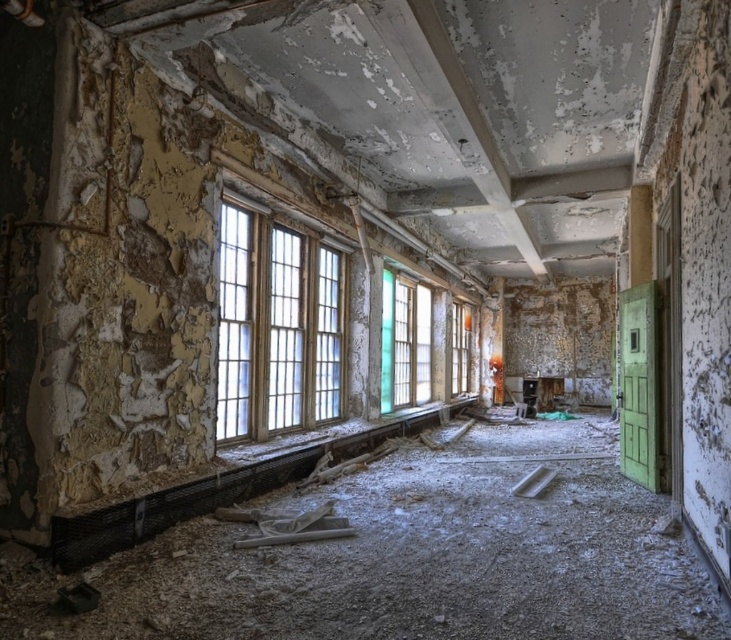
Question: Is clear glass window at center below green glass window at center?

Choices:
 (A) yes
 (B) no

Answer: (B)

Question: Does clear glass window at center have a larger size compared to green glass window at center?

Choices:
 (A) no
 (B) yes

Answer: (A)

Question: Observing the image, what is the correct spatial positioning of clear glass window at center in reference to translucent glass window at center?

Choices:
 (A) left
 (B) right

Answer: (A)

Question: Among these objects, which one is nearest to the camera?

Choices:
 (A) translucent glass window at center
 (B) green glass window at center
 (C) clear glass window at center

Answer: (C)

Question: Which of the following is the closest to the observer?

Choices:
 (A) translucent glass window at center
 (B) clear glass window at center
 (C) green glass window at center

Answer: (B)

Question: Which point is farther to the camera?

Choices:
 (A) green glass window at center
 (B) clear glass window at center

Answer: (A)